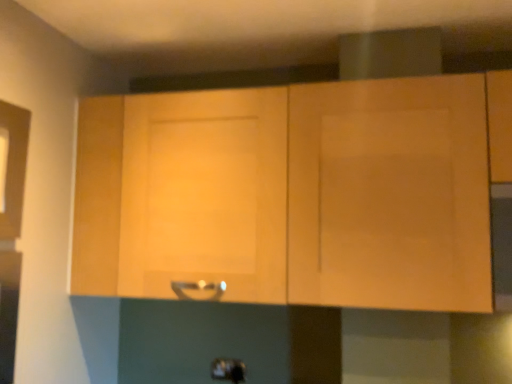
The width and height of the screenshot is (512, 384). Describe the element at coordinates (298, 193) in the screenshot. I see `light wood cabinet at center` at that location.

Find the location of a particular element. light wood cabinet at center is located at coordinates (298, 193).

Image resolution: width=512 pixels, height=384 pixels. Find the location of `satin silver handle at center`. satin silver handle at center is located at coordinates (228, 370).

Describe the element at coordinates (228, 370) in the screenshot. I see `satin silver handle at center` at that location.

Locate an element on the screen. This screenshot has height=384, width=512. light wood cabinet at center is located at coordinates (298, 193).

Consider the image. Which object is positioned more to the left, satin silver handle at center or light wood cabinet at center?

satin silver handle at center.

Looking at this image, is satin silver handle at center closer to the viewer compared to light wood cabinet at center?

No, it is not.

In the scene shown: Which point is more distant from viewer, (x=219, y=374) or (x=96, y=160)?

The point (x=219, y=374) is farther from the camera.

From the image's perspective, which is above, satin silver handle at center or light wood cabinet at center?

light wood cabinet at center.

From a real-world perspective, is satin silver handle at center above or below light wood cabinet at center?

Clearly, from a real-world perspective, satin silver handle at center is below light wood cabinet at center.

Can you confirm if satin silver handle at center is wider than light wood cabinet at center?

In fact, satin silver handle at center might be narrower than light wood cabinet at center.

Between satin silver handle at center and light wood cabinet at center, which one has more height?

light wood cabinet at center is taller.

Can you confirm if satin silver handle at center is smaller than light wood cabinet at center?

Yes, satin silver handle at center is smaller than light wood cabinet at center.

Would you say satin silver handle at center is inside or outside light wood cabinet at center?

satin silver handle at center is spatially situated outside light wood cabinet at center.

Are satin silver handle at center and light wood cabinet at center far apart?

No, satin silver handle at center is not far away from light wood cabinet at center.

Is light wood cabinet at center at the back of satin silver handle at center?

That's not correct — satin silver handle at center is not looking away from light wood cabinet at center.

Identify the location of cabinetry located above the satin silver handle at center (from a real-world perspective). This screenshot has height=384, width=512. (298, 193).

Between light wood cabinet at center and satin silver handle at center, which one appears on the right side from the viewer's perspective?

Positioned to the right is light wood cabinet at center.

Which object is closer to the camera taking this photo, light wood cabinet at center or satin silver handle at center?

light wood cabinet at center is more forward.

Which is nearer, [207,129] or [217,369]?

Positioned in front is point [207,129].

From the picture: From the image's perspective, is light wood cabinet at center positioned above or below satin silver handle at center?

From the image's perspective, light wood cabinet at center appears above satin silver handle at center.

From a real-world perspective, who is located higher, light wood cabinet at center or satin silver handle at center?

light wood cabinet at center, from a real-world perspective.

Is light wood cabinet at center wider or thinner than satin silver handle at center?

light wood cabinet at center is wider than satin silver handle at center.

Considering the sizes of objects light wood cabinet at center and satin silver handle at center in the image provided, who is taller, light wood cabinet at center or satin silver handle at center?

Standing taller between the two is light wood cabinet at center.

Is light wood cabinet at center bigger than satin silver handle at center?

Correct, light wood cabinet at center is larger in size than satin silver handle at center.

Is light wood cabinet at center spatially inside satin silver handle at center, or outside of it?

light wood cabinet at center is outside satin silver handle at center.

Is light wood cabinet at center not near satin silver handle at center?

No, light wood cabinet at center is not far from satin silver handle at center.

Is light wood cabinet at center aimed at satin silver handle at center?

No, light wood cabinet at center does not turn towards satin silver handle at center.

What's the angular difference between light wood cabinet at center and satin silver handle at center's facing directions?

0.401 degrees.

Find the location of `door handle below the light wood cabinet at center (from the image's perspective)`. door handle below the light wood cabinet at center (from the image's perspective) is located at coordinates (228, 370).

I want to click on cabinetry in front of the satin silver handle at center, so click(x=298, y=193).

Find the location of a particular element. The height and width of the screenshot is (384, 512). door handle behind the light wood cabinet at center is located at coordinates (228, 370).